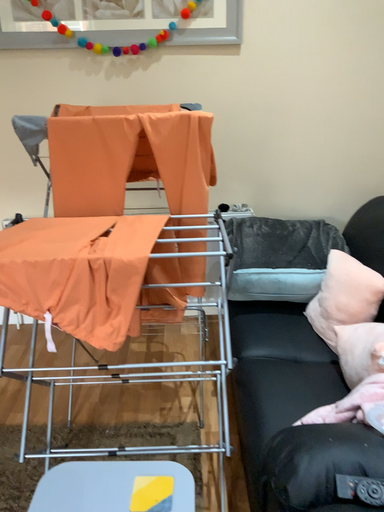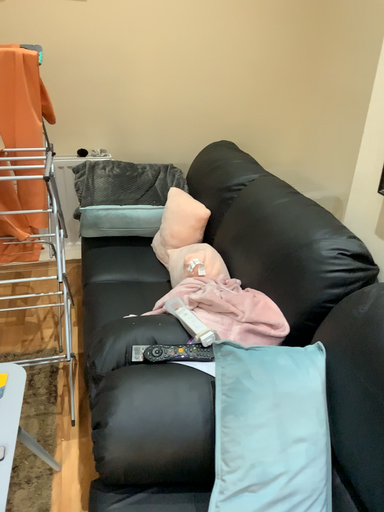
Question: How did the camera likely rotate when shooting the video?

Choices:
 (A) rotated left
 (B) rotated right

Answer: (B)